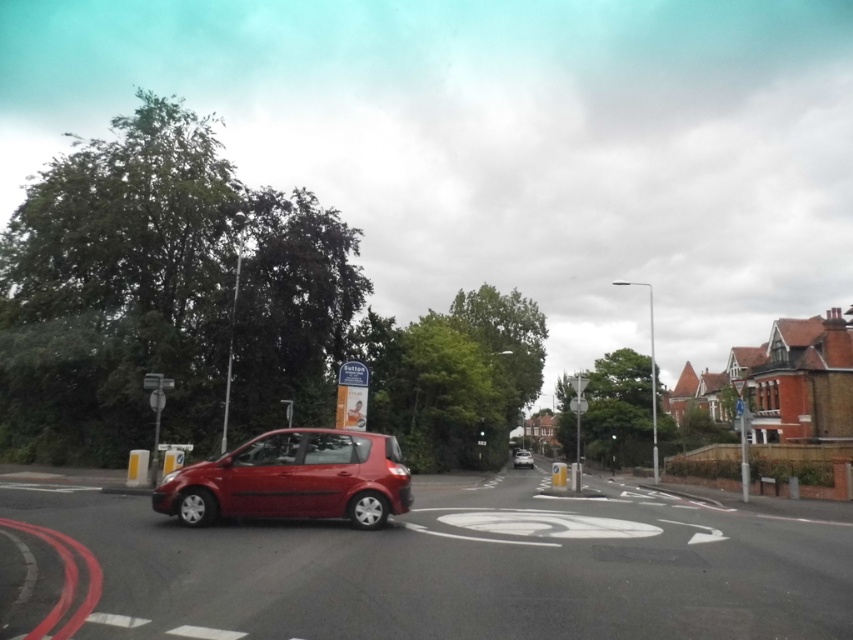
Question: Which of the following is the farthest from the observer?

Choices:
 (A) (529, 458)
 (B) (496, 577)
 (C) (254, 486)

Answer: (A)

Question: Which object is closer to the camera taking this photo?

Choices:
 (A) metallic silver hatchback at center
 (B) glossy red hatchback at center-left
 (C) shiny metallic car at lower left

Answer: (C)

Question: Is shiny metallic car at lower left closer to camera compared to glossy red hatchback at center-left?

Choices:
 (A) yes
 (B) no

Answer: (A)

Question: Which of the following is the farthest from the observer?

Choices:
 (A) shiny metallic car at lower left
 (B) glossy red hatchback at center-left
 (C) metallic silver hatchback at center

Answer: (C)

Question: Does glossy red hatchback at center-left appear under metallic silver hatchback at center?

Choices:
 (A) no
 (B) yes

Answer: (A)

Question: Can you confirm if shiny metallic car at lower left is positioned above glossy red hatchback at center-left?

Choices:
 (A) no
 (B) yes

Answer: (A)